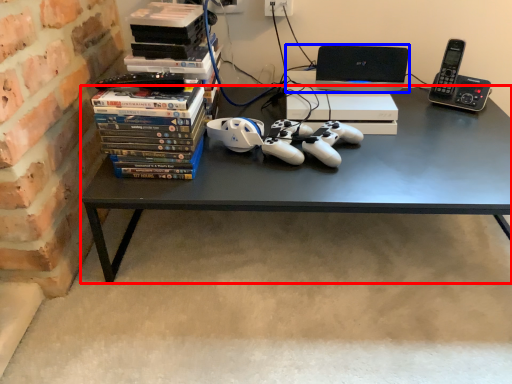
Question: Among these objects, which one is farthest to the camera, desk (highlighted by a red box) or computer (highlighted by a blue box)?

Choices:
 (A) desk
 (B) computer

Answer: (B)